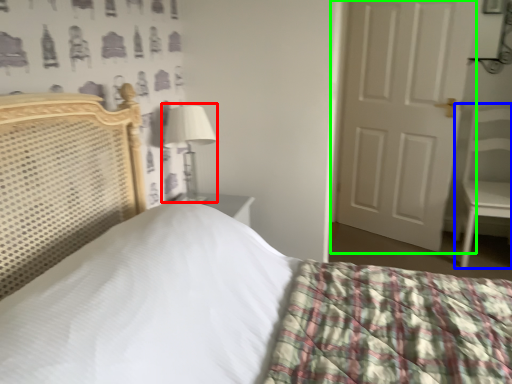
Question: Based on their relative distances, which object is nearer to table lamp (highlighted by a red box)? Choose from armchair (highlighted by a blue box) and door (highlighted by a green box).

Choices:
 (A) armchair
 (B) door

Answer: (B)